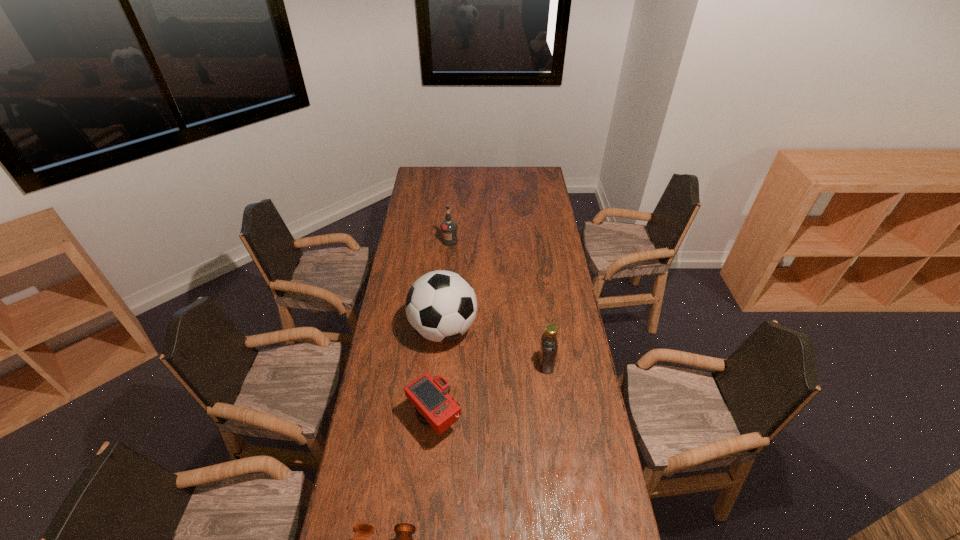
Identify the location of soccer ball. The image size is (960, 540). (441, 306).

Locate an element on the screen. the farther vodka is located at coordinates (448, 227).

Locate an element on the screen. Image resolution: width=960 pixels, height=540 pixels. the farthest object is located at coordinates (448, 227).

I want to click on the nearer vodka, so click(x=548, y=349).

Where is `the right vodka`? the right vodka is located at coordinates (548, 349).

This screenshot has width=960, height=540. What are the coordinates of `camera` in the screenshot? It's located at (434, 407).

Where is `vacant space located 0.110m on the front of the tallest object`? The width and height of the screenshot is (960, 540). vacant space located 0.110m on the front of the tallest object is located at coordinates (440, 381).

At what (x,y) coordinates should I click in order to perform the action: click on vacant area located 0.110m on the front label of the farthest object. Please return your answer as a coordinate pair (x, y). The height and width of the screenshot is (540, 960). Looking at the image, I should click on (448, 261).

At what (x,y) coordinates should I click in order to perform the action: click on free spot located on the front-facing side of the rightmost object. Please return your answer as a coordinate pair (x, y). This screenshot has height=540, width=960. Looking at the image, I should click on (470, 364).

You are a GUI agent. You are given a task and a screenshot of the screen. Output one action in this format:
    pyautogui.click(x=<x>, y=<y>)
    Task: Click on the vacant area situated 0.220m on the front-facing side of the rightmost object
    Image resolution: width=960 pixels, height=540 pixels.
    Given the screenshot: What is the action you would take?
    pyautogui.click(x=481, y=364)